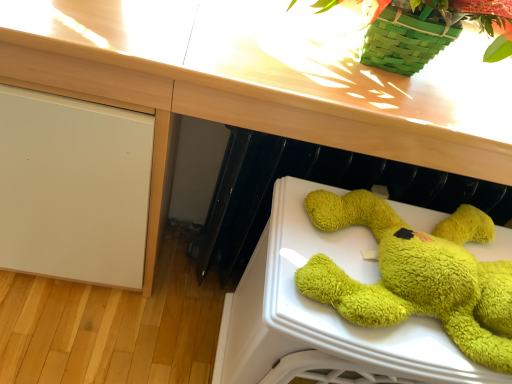
This screenshot has width=512, height=384. I want to click on free space above wooden at upper center (from a real-world perspective), so click(x=385, y=61).